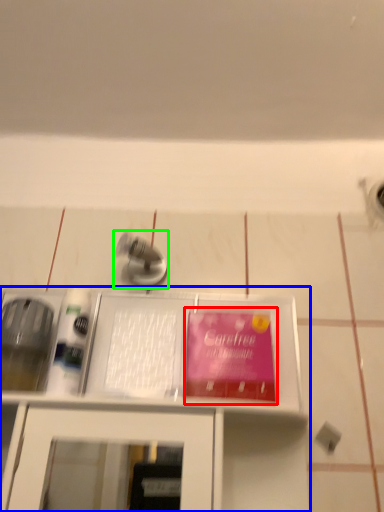
Question: Based on their relative distances, which object is farther from paperback book (highlighted by a red box)? Choose from furniture (highlighted by a blue box) and tap (highlighted by a green box).

Choices:
 (A) furniture
 (B) tap

Answer: (B)